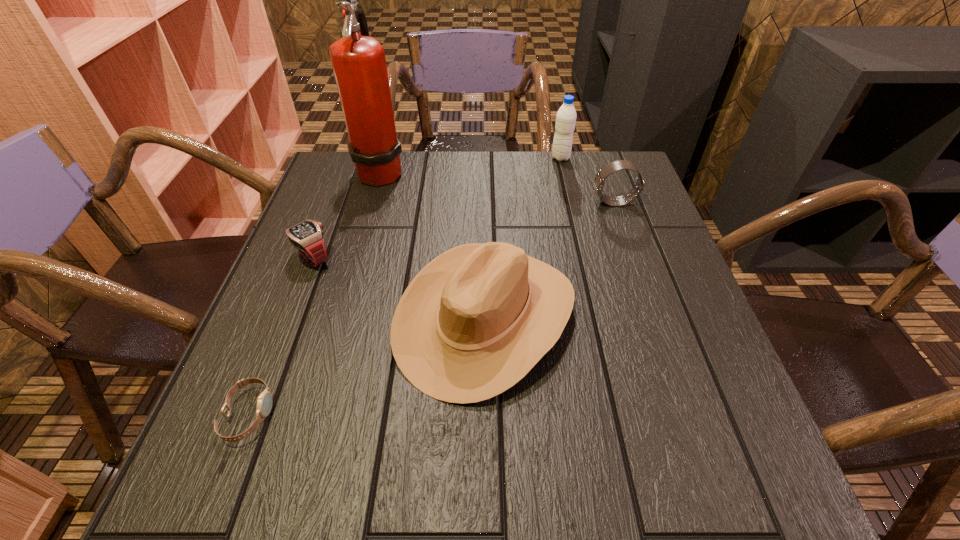
Where is `the tallest object`? The width and height of the screenshot is (960, 540). the tallest object is located at coordinates (359, 64).

Locate an element on the screen. The image size is (960, 540). water bottle is located at coordinates (566, 116).

This screenshot has height=540, width=960. What are the coordinates of `the second tallest object` in the screenshot? It's located at (566, 116).

This screenshot has height=540, width=960. What are the coordinates of `the third object from right to left` in the screenshot? It's located at (474, 321).

Identify the location of the third tallest object. (474, 321).

This screenshot has width=960, height=540. Find the location of `the third shortest object`. the third shortest object is located at coordinates point(612,167).

Find the location of a particular element. This screenshot has height=540, width=960. the third farthest object is located at coordinates (612, 167).

Locate an element on the screen. the second farthest watch is located at coordinates (307, 236).

This screenshot has width=960, height=540. I want to click on the second tallest watch, so click(x=307, y=236).

This screenshot has height=540, width=960. I want to click on the shortest watch, so click(264, 404).